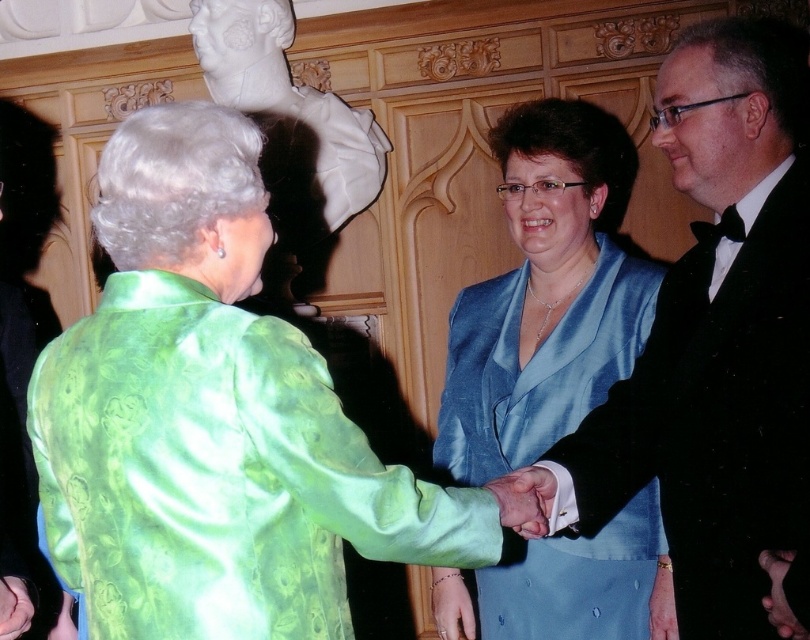
Question: Which object is the closest to the white marble bust at upper center?

Choices:
 (A) smooth leather hand at center
 (B) black satin tuxedo at right
 (C) matte gold bracelet at lower center

Answer: (C)

Question: Which point appears closest to the camera in this image?

Choices:
 (A) [301, 124]
 (B) [1, 582]
 (C) [508, 490]
 (D) [433, 621]

Answer: (C)

Question: Is white marble bust at upper center smaller than smooth leather hand at center?

Choices:
 (A) no
 (B) yes

Answer: (A)

Question: Which object is positioned closest to the white marble bust at upper center?

Choices:
 (A) green satin blouse at center
 (B) satin blue dress at center

Answer: (B)

Question: Can you confirm if black satin tuxedo at right is smaller than white marble bust at upper center?

Choices:
 (A) no
 (B) yes

Answer: (A)

Question: Can you confirm if white marble bust at upper center is smaller than dark skin hand at lower right?

Choices:
 (A) no
 (B) yes

Answer: (A)